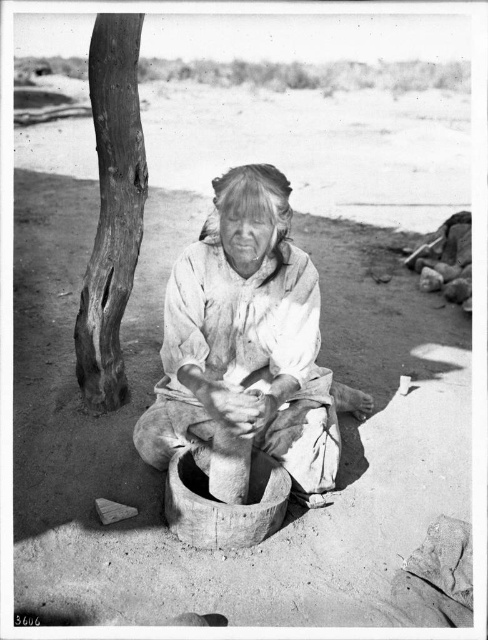
Who is lower down, white clothed woman at center or smooth bark tree trunk at left?

white clothed woman at center is below.

Describe the element at coordinates (247, 340) in the screenshot. The width and height of the screenshot is (488, 640). I see `white clothed woman at center` at that location.

Who is more distant from viewer, [267,193] or [124,52]?

The point [124,52] is more distant.

You are a GUI agent. You are given a task and a screenshot of the screen. Output one action in this format:
    pyautogui.click(x=<x>, y=<y>)
    Task: Click on the white clothed woman at center
    
    Given the screenshot: What is the action you would take?
    pyautogui.click(x=247, y=340)